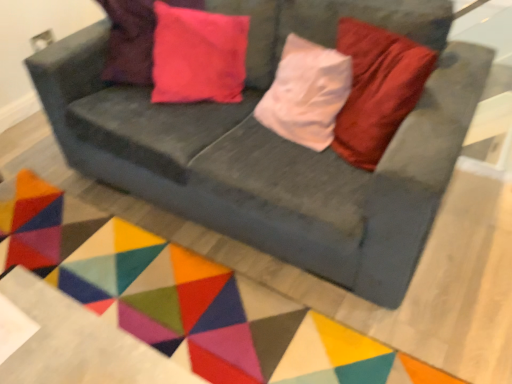
Question: Does velvet gray couch at center have a greater height compared to pink velvet pillow at upper left?

Choices:
 (A) yes
 (B) no

Answer: (A)

Question: Is velvet gray couch at center facing away from pink velvet pillow at upper left?

Choices:
 (A) no
 (B) yes

Answer: (B)

Question: Does velvet gray couch at center have a smaller size compared to pink velvet pillow at upper left?

Choices:
 (A) yes
 (B) no

Answer: (B)

Question: Can you confirm if velvet gray couch at center is positioned to the left of pink velvet pillow at upper left?

Choices:
 (A) no
 (B) yes

Answer: (A)

Question: Would you consider velvet gray couch at center to be distant from pink velvet pillow at upper left?

Choices:
 (A) no
 (B) yes

Answer: (A)

Question: Considering the relative sizes of velvet gray couch at center and pink velvet pillow at upper left in the image provided, is velvet gray couch at center shorter than pink velvet pillow at upper left?

Choices:
 (A) yes
 (B) no

Answer: (B)

Question: Is geometric fabric mat at center turned away from pink velvet pillow at upper left?

Choices:
 (A) yes
 (B) no

Answer: (B)

Question: Is geometric fabric mat at center smaller than pink velvet pillow at upper left?

Choices:
 (A) no
 (B) yes

Answer: (B)

Question: Would you say geometric fabric mat at center contains pink velvet pillow at upper left?

Choices:
 (A) yes
 (B) no

Answer: (B)

Question: Considering the relative sizes of geometric fabric mat at center and pink velvet pillow at upper left in the image provided, is geometric fabric mat at center taller than pink velvet pillow at upper left?

Choices:
 (A) yes
 (B) no

Answer: (B)

Question: From the image's perspective, does geometric fabric mat at center appear lower than pink velvet pillow at upper left?

Choices:
 (A) yes
 (B) no

Answer: (A)

Question: Considering the relative positions of geometric fabric mat at center and pink velvet pillow at upper left in the image provided, is geometric fabric mat at center to the left of pink velvet pillow at upper left from the viewer's perspective?

Choices:
 (A) no
 (B) yes

Answer: (B)

Question: From the image's perspective, is velvet gray couch at center located beneath geometric fabric mat at center?

Choices:
 (A) yes
 (B) no

Answer: (B)